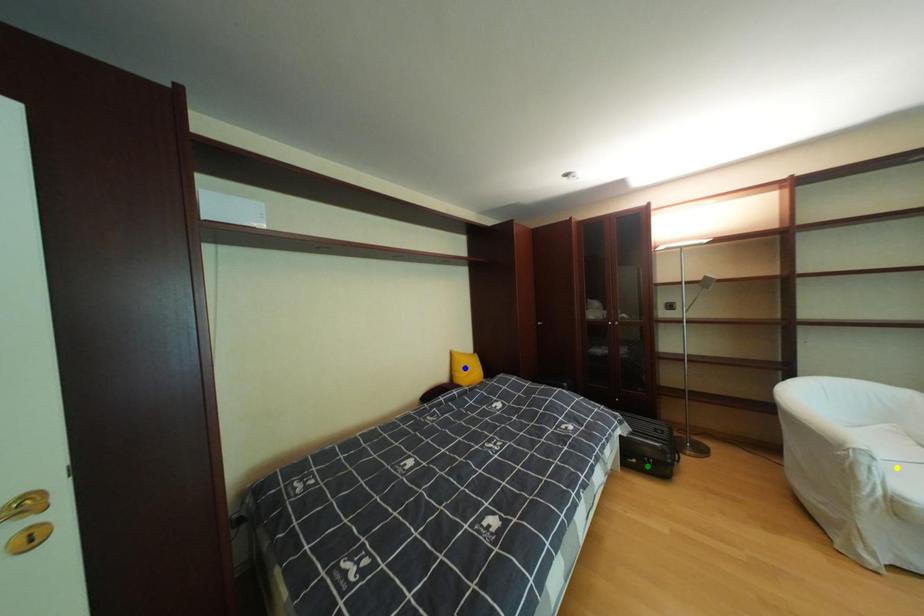
Order these from nearest to farthest:
A) yellow point
B) blue point
C) green point

yellow point → green point → blue point